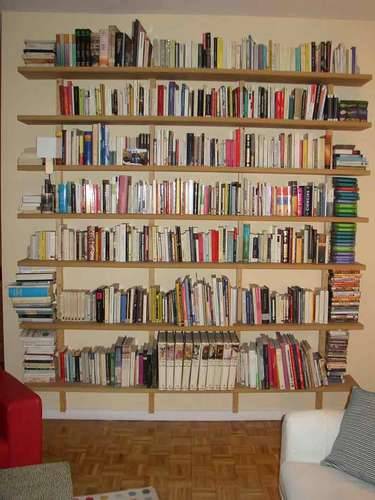
Locate an element on the screen. The height and width of the screenshot is (500, 375). pillow is located at coordinates (358, 441).